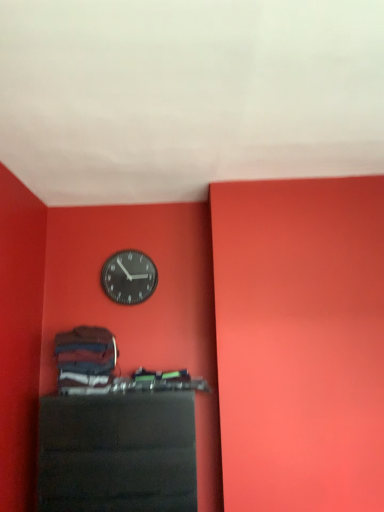
Image resolution: width=384 pixels, height=512 pixels. What do you see at coordinates (118, 453) in the screenshot?
I see `black glossy shelf at lower center` at bounding box center [118, 453].

This screenshot has width=384, height=512. I want to click on black glossy shelf at lower center, so click(118, 453).

Describe the element at coordinates (129, 277) in the screenshot. I see `metallic black clock at upper center` at that location.

Where is `metallic black clock at upper center`? Image resolution: width=384 pixels, height=512 pixels. metallic black clock at upper center is located at coordinates (129, 277).

What is the approximate height of metallic black clock at upper center?

metallic black clock at upper center is 39.36 centimeters tall.

In order to face metallic black clock at upper center, should I rotate leftwards or rightwards?

Turn left approximately 8.472 degrees to face it.

Where is `black glossy shelf at lower center`? black glossy shelf at lower center is located at coordinates (118, 453).

Consider the image. Which object is positioned more to the left, metallic black clock at upper center or black glossy shelf at lower center?

metallic black clock at upper center is more to the left.

Is the position of metallic black clock at upper center less distant than that of black glossy shelf at lower center?

No, it is behind black glossy shelf at lower center.

Considering the points (120, 270) and (113, 403), which point is in front, point (120, 270) or point (113, 403)?

The point (113, 403) is closer.

From the image's perspective, is metallic black clock at upper center located above or below black glossy shelf at lower center?

metallic black clock at upper center is above black glossy shelf at lower center.

From a real-world perspective, which is physically above, metallic black clock at upper center or black glossy shelf at lower center?

metallic black clock at upper center.

Looking at their sizes, would you say metallic black clock at upper center is wider or thinner than black glossy shelf at lower center?

In the image, metallic black clock at upper center appears to be more narrow than black glossy shelf at lower center.

In terms of height, does metallic black clock at upper center look taller or shorter compared to black glossy shelf at lower center?

Considering their sizes, metallic black clock at upper center has less height than black glossy shelf at lower center.

Considering the sizes of objects metallic black clock at upper center and black glossy shelf at lower center in the image provided, who is bigger, metallic black clock at upper center or black glossy shelf at lower center?

black glossy shelf at lower center is bigger.

Is black glossy shelf at lower center inside metallic black clock at upper center?

No, black glossy shelf at lower center is not surrounded by metallic black clock at upper center.

Is there a large distance between metallic black clock at upper center and black glossy shelf at lower center?

metallic black clock at upper center is actually quite close to black glossy shelf at lower center.

Is metallic black clock at upper center oriented towards black glossy shelf at lower center?

No, metallic black clock at upper center is not oriented towards black glossy shelf at lower center.

What's the angular difference between metallic black clock at upper center and black glossy shelf at lower center's facing directions?

There is a 2.42-degree angle between the facing directions of metallic black clock at upper center and black glossy shelf at lower center.

How distant is metallic black clock at upper center from black glossy shelf at lower center?

A distance of 36.74 inches exists between metallic black clock at upper center and black glossy shelf at lower center.

Where is `wall clock to the left of black glossy shelf at lower center`? The image size is (384, 512). wall clock to the left of black glossy shelf at lower center is located at coordinates (129, 277).

Which is more to the right, black glossy shelf at lower center or metallic black clock at upper center?

black glossy shelf at lower center.

Does black glossy shelf at lower center come in front of metallic black clock at upper center?

Yes, the depth of black glossy shelf at lower center is less than that of metallic black clock at upper center.

Between point (65, 482) and point (107, 286), which one is positioned behind?

The point (107, 286) is farther.

Consider the image. From the image's perspective, who appears lower, black glossy shelf at lower center or metallic black clock at upper center?

black glossy shelf at lower center.

From a real-world perspective, is black glossy shelf at lower center physically located above or below metallic black clock at upper center?

Clearly, from a real-world perspective, black glossy shelf at lower center is below metallic black clock at upper center.

Considering the sizes of objects black glossy shelf at lower center and metallic black clock at upper center in the image provided, who is wider, black glossy shelf at lower center or metallic black clock at upper center?

With larger width is black glossy shelf at lower center.

Does black glossy shelf at lower center have a greater height compared to metallic black clock at upper center?

Correct, black glossy shelf at lower center is much taller as metallic black clock at upper center.

Who is smaller, black glossy shelf at lower center or metallic black clock at upper center?

With smaller size is metallic black clock at upper center.

Is metallic black clock at upper center completely or partially inside black glossy shelf at lower center?

Actually, metallic black clock at upper center is outside black glossy shelf at lower center.

Is black glossy shelf at lower center in contact with metallic black clock at upper center?

No, black glossy shelf at lower center is not beside metallic black clock at upper center.

Is metallic black clock at upper center at the back of black glossy shelf at lower center?

No, black glossy shelf at lower center is not facing away from metallic black clock at upper center.

What's the angular difference between black glossy shelf at lower center and metallic black clock at upper center's facing directions?

The angular difference between black glossy shelf at lower center and metallic black clock at upper center is 2.42 degrees.

What are the coordinates of `wall clock on the left of black glossy shelf at lower center` in the screenshot? It's located at (129, 277).

There is a black glossy shelf at lower center. Where is `wall clock above it (from a real-world perspective)`? wall clock above it (from a real-world perspective) is located at coordinates (129, 277).

Where is `furniture that is on the right side of metallic black clock at upper center`? The height and width of the screenshot is (512, 384). furniture that is on the right side of metallic black clock at upper center is located at coordinates (118, 453).